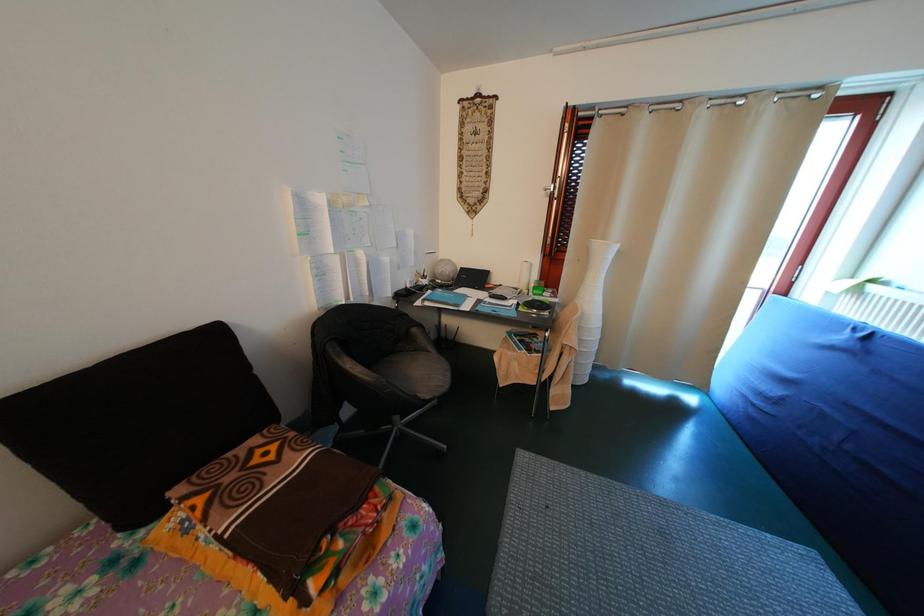
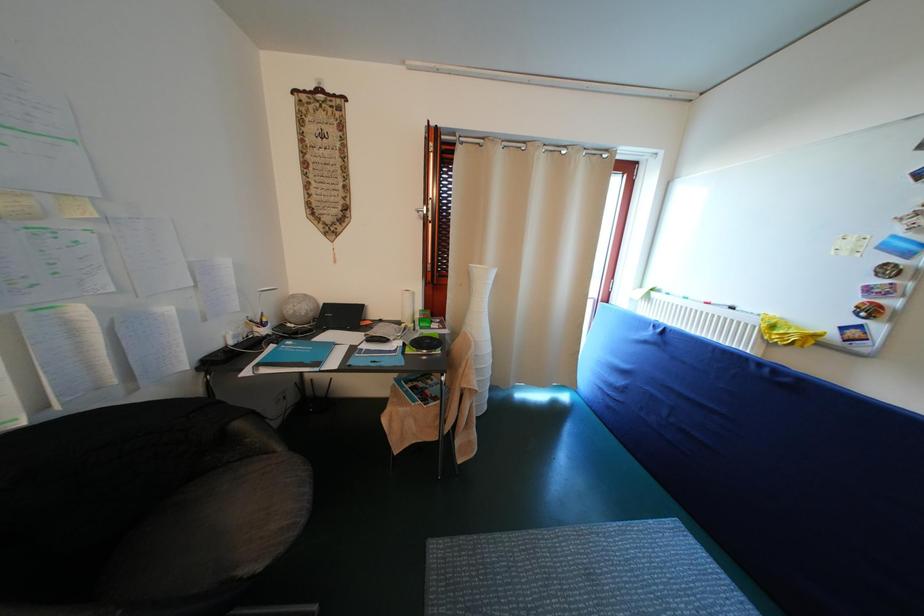
Question: In a continuous first-person perspective shot, in which direction is the camera moving?

Choices:
 (A) Left
 (B) Right
 (C) Forward
 (D) Backward

Answer: (C)